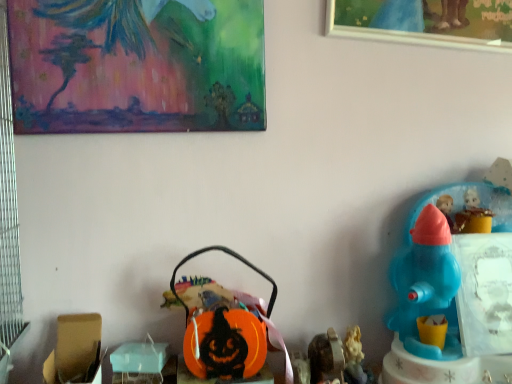
Question: Based on their sizes in the image, would you say metallic silver toy at lower center, the 3th toy from the right, is bigger or smaller than painted canvas at upper left, arranged as the first picture frame when viewed from the left?

Choices:
 (A) small
 (B) big

Answer: (A)

Question: Based on their positions, is metallic silver toy at lower center, marked as the third toy in a left-to-right arrangement, located to the left or right of painted canvas at upper left, the 2th picture frame positioned from the right?

Choices:
 (A) right
 (B) left

Answer: (A)

Question: Which is nearer to the blue plastic toy at right, placed as the 1th toy when sorted from right to left?

Choices:
 (A) orange plastic basket at center, the 2th toy in the left-to-right sequence
 (B) wooden picture frame at upper right, the 1th picture frame viewed from the right
 (C) matte plastic figurine at lower right, the 2th toy from the right
 (D) painted canvas at upper left, arranged as the first picture frame when viewed from the left
 (E) matte cardboard box at lower left, the first toy positioned from the left

Answer: (C)

Question: Estimate the real-world distances between objects in this image. Which object is farther from the painted canvas at upper left, the 2th picture frame positioned from the right?

Choices:
 (A) blue plastic toy at right, placed as the fifth toy when sorted from left to right
 (B) metallic silver toy at lower center, marked as the third toy in a left-to-right arrangement
 (C) wooden picture frame at upper right, the 1th picture frame viewed from the right
 (D) matte cardboard box at lower left, the first toy positioned from the left
 (E) matte plastic figurine at lower right, the 2th toy from the right

Answer: (E)